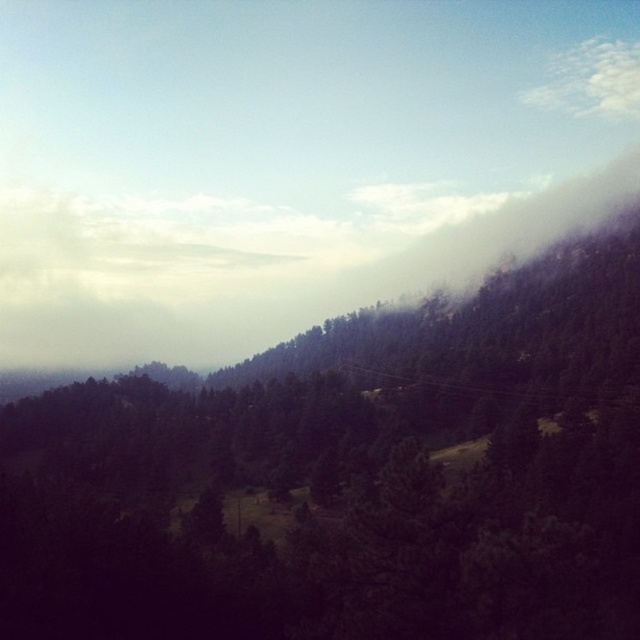
Question: Is green matte tree at center bigger than white fluffy cloud at upper right?

Choices:
 (A) no
 (B) yes

Answer: (B)

Question: Can you confirm if green matte tree at center is positioned below white fluffy cloud at upper right?

Choices:
 (A) yes
 (B) no

Answer: (A)

Question: Can you confirm if green matte tree at center is wider than white fluffy cloud at upper right?

Choices:
 (A) no
 (B) yes

Answer: (B)

Question: Which of the following is the farthest from the observer?

Choices:
 (A) (630, 106)
 (B) (627, 401)

Answer: (A)

Question: Which of the following is the farthest from the observer?

Choices:
 (A) green matte tree at center
 (B) white fluffy cloud at upper right

Answer: (B)